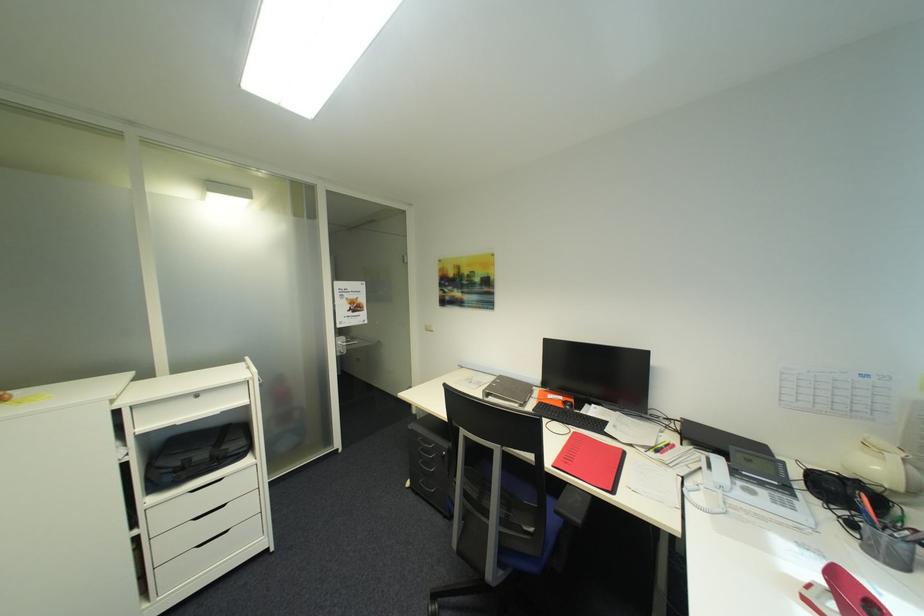
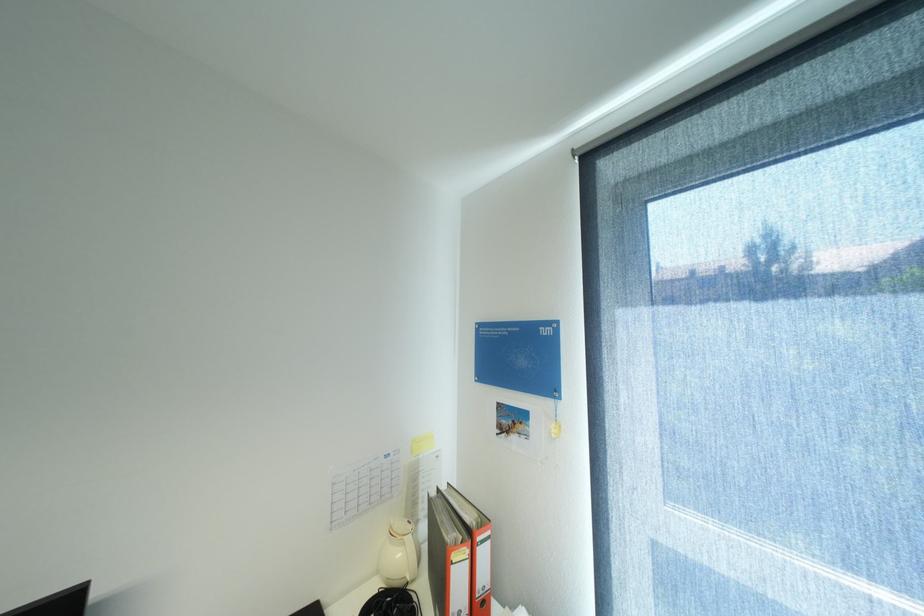
Locate, in the second image, the point that corresponds to (x=886, y=469) in the first image.

(407, 554)